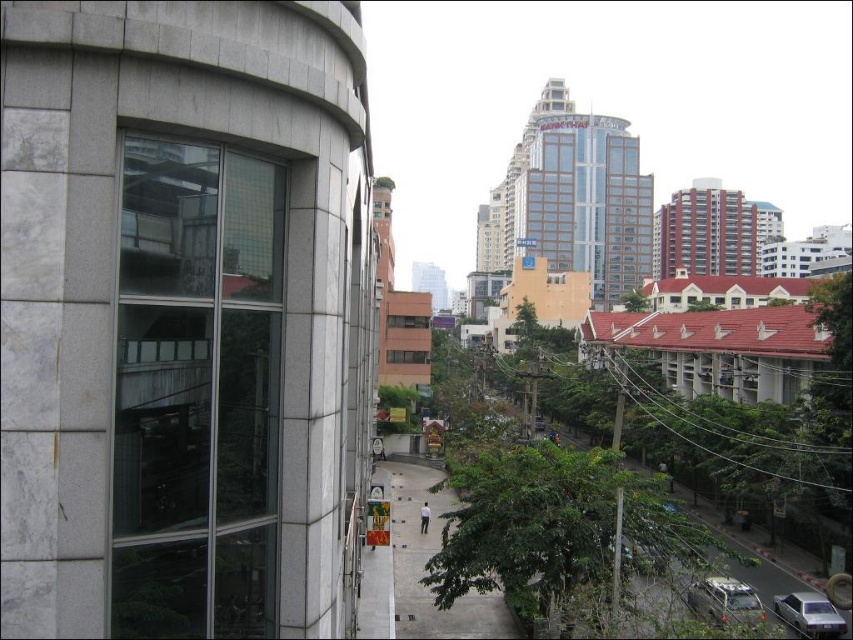
You are standing on the balcony of the building in the foreground and want to take a photo of both the metallic silver car at lower right and the silver metallic sedan at bottom right. Which car should you focus on first to ensure both are in clear view?

You should focus on the metallic silver car at lower right first because it is closer to you than the silver metallic sedan at bottom right, so adjusting focus from near to far will help capture both in clear view.

You are an architect designing a new building and want to incorporate elements from this scene. If you need to ensure that the transparent glass window at left in your design is as thin as possible while still being functional, how does its thickness compare to the silver metallic sedan at bottom right in the original image?

The transparent glass window at left is thinner than the silver metallic sedan at bottom right.